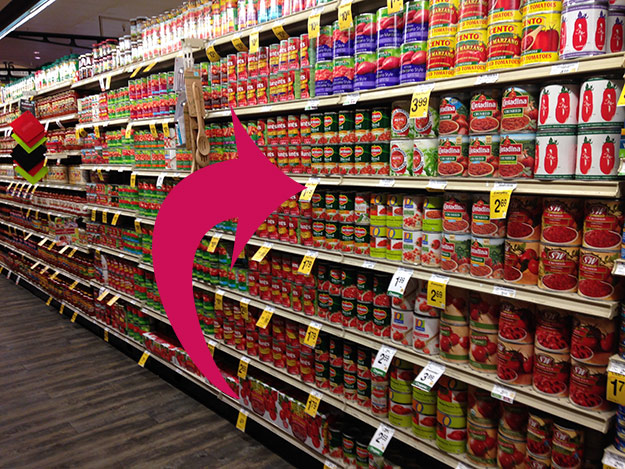
Find the location of a particular element. The width and height of the screenshot is (625, 469). floor in front of shelves is located at coordinates (27, 410), (152, 433).